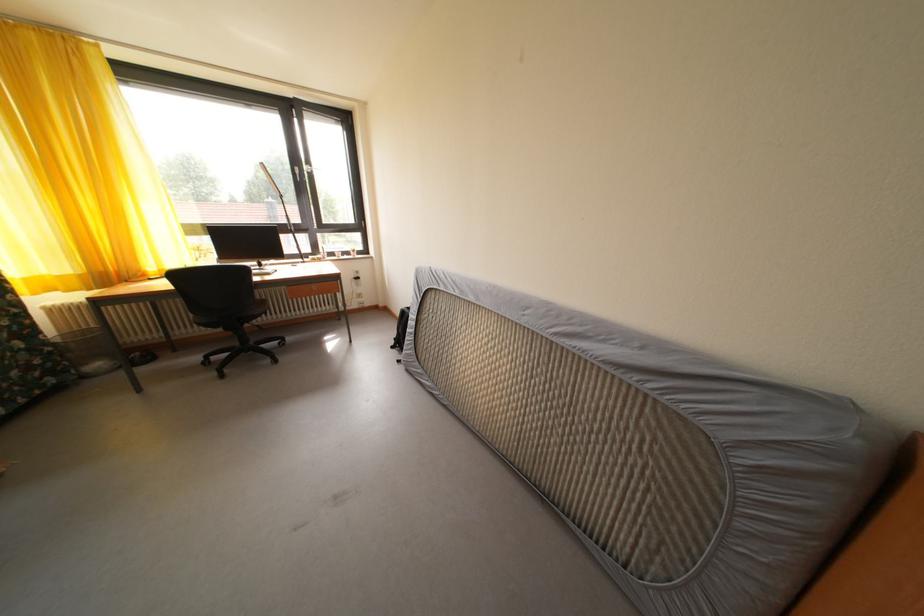
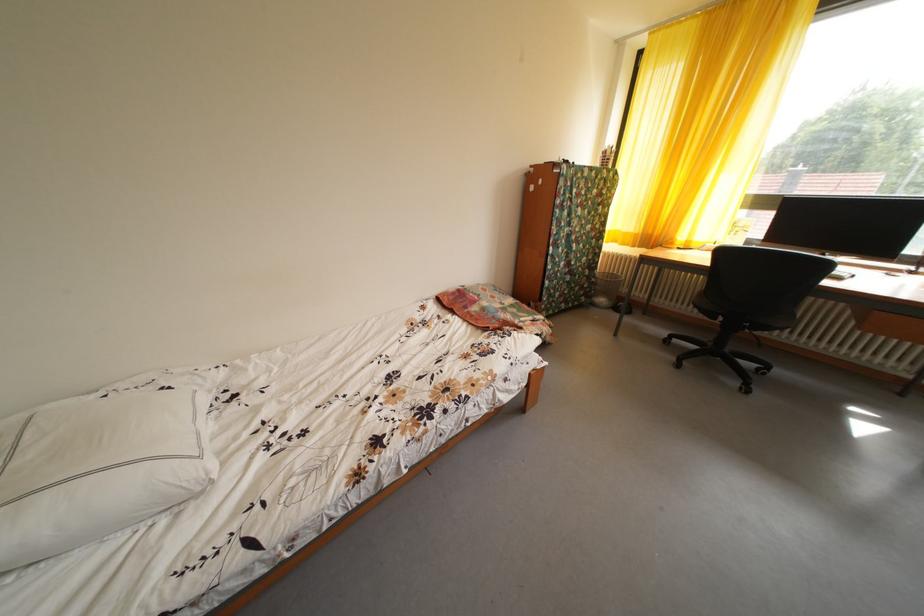
In the second image, find the point that corresponds to point 46,368 in the first image.

(594, 292)